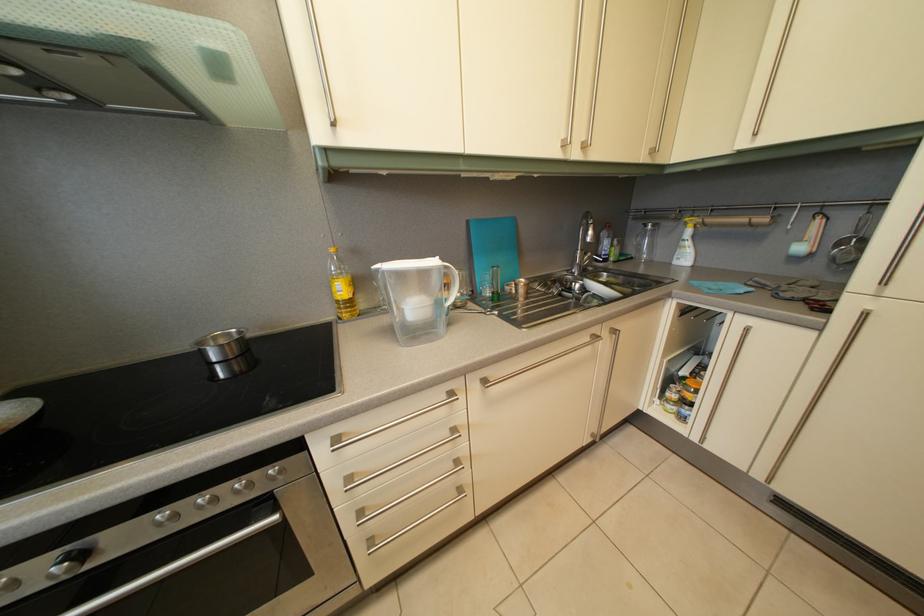
Where would you pull the paper towel roll? Please return your answer as a coordinate pair (x, y).

(809, 237)